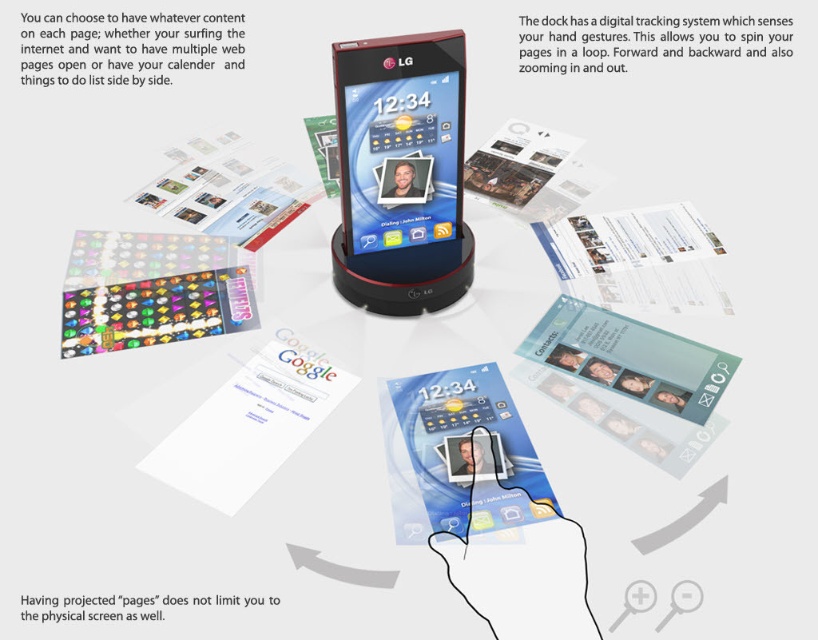
Question: Can you confirm if matte black phone at center is positioned to the right of matte plastic card game at center?

Choices:
 (A) yes
 (B) no

Answer: (B)

Question: Is matte black phone at center thinner than matte plastic card game at center?

Choices:
 (A) no
 (B) yes

Answer: (A)

Question: Is matte black phone at center to the right of matte plastic card game at center from the viewer's perspective?

Choices:
 (A) yes
 (B) no

Answer: (B)

Question: Which point is farther to the camera?

Choices:
 (A) (463, 86)
 (B) (502, 528)

Answer: (A)